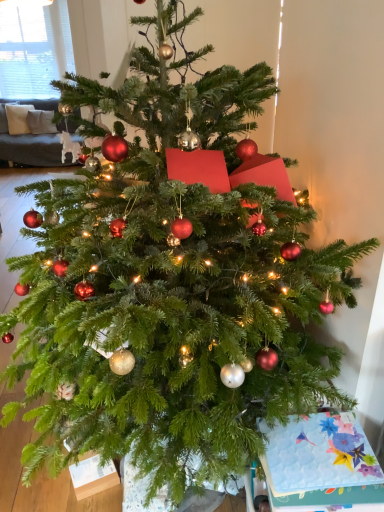
The width and height of the screenshot is (384, 512). Find the location of `white blinds at upper left`. white blinds at upper left is located at coordinates (34, 49).

The height and width of the screenshot is (512, 384). Describe the element at coordinates (34, 49) in the screenshot. I see `white blinds at upper left` at that location.

Measure the distance between point (324,426) and camera.

Point (324,426) and camera are 1.31 meters apart from each other.

The width and height of the screenshot is (384, 512). I want to click on floral paper card at lower right, so click(321, 462).

Image resolution: width=384 pixels, height=512 pixels. Describe the element at coordinates (321, 462) in the screenshot. I see `floral paper card at lower right` at that location.

Locate an element on the screen. The width and height of the screenshot is (384, 512). white blinds at upper left is located at coordinates (34, 49).

Would you say floral paper card at lower right is to the left or to the right of white blinds at upper left in the picture?

floral paper card at lower right is positioned on white blinds at upper left's right side.

Is floral paper card at lower right positioned behind white blinds at upper left?

No, it is not.

Which point is more forward, (266, 474) or (40, 64)?

Point (266, 474)

From the image's perspective, between floral paper card at lower right and white blinds at upper left, who is located below?

floral paper card at lower right, from the image's perspective.

From a real-world perspective, which is physically below, floral paper card at lower right or white blinds at upper left?

floral paper card at lower right, from a real-world perspective.

Does floral paper card at lower right have a greater width compared to white blinds at upper left?

Yes, floral paper card at lower right is wider than white blinds at upper left.

Considering the sizes of objects floral paper card at lower right and white blinds at upper left in the image provided, who is shorter, floral paper card at lower right or white blinds at upper left?

Standing shorter between the two is floral paper card at lower right.

Is floral paper card at lower right bigger or smaller than white blinds at upper left?

Clearly, floral paper card at lower right is smaller in size than white blinds at upper left.

Is floral paper card at lower right situated inside white blinds at upper left or outside?

floral paper card at lower right is not enclosed by white blinds at upper left.

Is floral paper card at lower right beside white blinds at upper left?

There is a gap between floral paper card at lower right and white blinds at upper left.

Is floral paper card at lower right positioned with its back to white blinds at upper left?

Yes.

How many degrees apart are the facing directions of floral paper card at lower right and white blinds at upper left?

The facing directions of floral paper card at lower right and white blinds at upper left are 6.34 degrees apart.

Find the location of a particular element. window screen that appears above the floral paper card at lower right (from a real-world perspective) is located at coordinates (34, 49).

Considering the positions of objects white blinds at upper left and floral paper card at lower right in the image provided, who is more to the right, white blinds at upper left or floral paper card at lower right?

Positioned to the right is floral paper card at lower right.

Is white blinds at upper left positioned before floral paper card at lower right?

No, white blinds at upper left is behind floral paper card at lower right.

Which is farther from the camera, [59,42] or [327,448]?

The point [59,42] is more distant.

From the image's perspective, is white blinds at upper left located beneath floral paper card at lower right?

Actually, white blinds at upper left appears above floral paper card at lower right in the image.

From a real-world perspective, which is physically above, white blinds at upper left or floral paper card at lower right?

From a 3D spatial view, white blinds at upper left is above.

Based on the photo, in terms of width, does white blinds at upper left look wider or thinner when compared to floral paper card at lower right?

white blinds at upper left is thinner than floral paper card at lower right.

Considering the sizes of objects white blinds at upper left and floral paper card at lower right in the image provided, who is shorter, white blinds at upper left or floral paper card at lower right?

floral paper card at lower right.

Which of these two, white blinds at upper left or floral paper card at lower right, is smaller?

Smaller between the two is floral paper card at lower right.

Can we say white blinds at upper left lies outside floral paper card at lower right?

Yes, white blinds at upper left is located beyond the bounds of floral paper card at lower right.

Is white blinds at upper left next to floral paper card at lower right and touching it?

No, white blinds at upper left is not beside floral paper card at lower right.

Is floral paper card at lower right at the back of white blinds at upper left?

No, white blinds at upper left is not facing the opposite direction of floral paper card at lower right.

How much distance is there between white blinds at upper left and floral paper card at lower right?

white blinds at upper left and floral paper card at lower right are 4.37 meters apart.

Identify the location of christmas card below the white blinds at upper left (from the image's perspective). (321, 462).

Where is `window screen above the floral paper card at lower right (from the image's perspective)`? The width and height of the screenshot is (384, 512). window screen above the floral paper card at lower right (from the image's perspective) is located at coordinates (34, 49).

Locate an element on the screen. This screenshot has height=512, width=384. window screen lying behind the floral paper card at lower right is located at coordinates (34, 49).